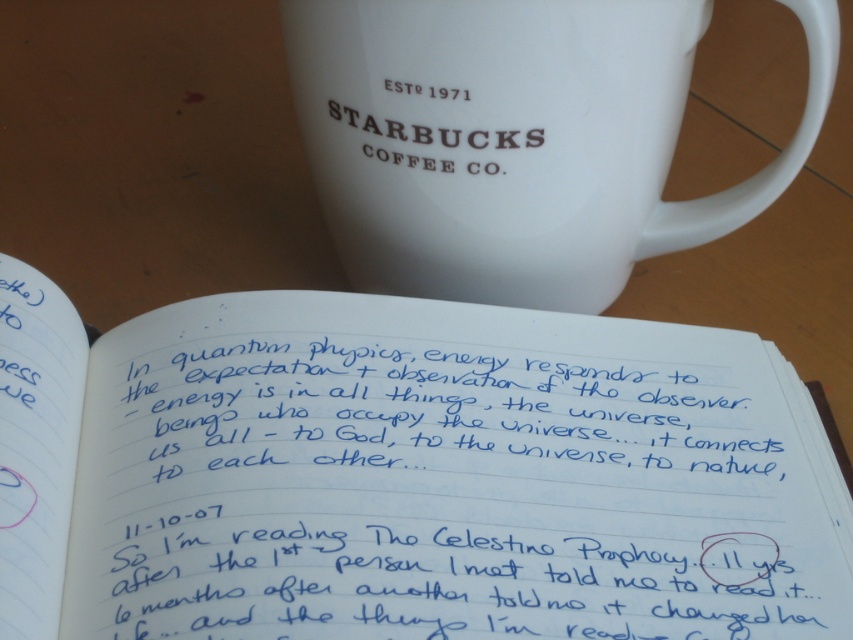
Does point (305, 333) lie in front of point (440, 17)?

That is False.

Does white paper notebook at upper center appear over white ceramic mug at upper center?

No.

Which is behind, point (543, 458) or point (827, 88)?

The point (827, 88) is behind.

You are a GUI agent. You are given a task and a screenshot of the screen. Output one action in this format:
    pyautogui.click(x=<x>, y=<y>)
    Task: Click on the white paper notebook at upper center
    Image resolution: width=853 pixels, height=640 pixels.
    Given the screenshot: What is the action you would take?
    pyautogui.click(x=405, y=474)